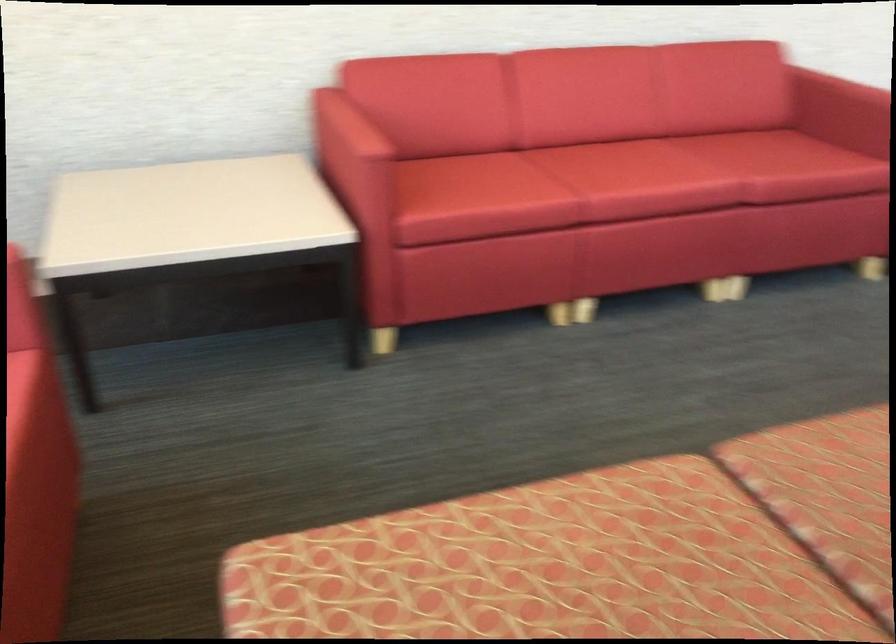
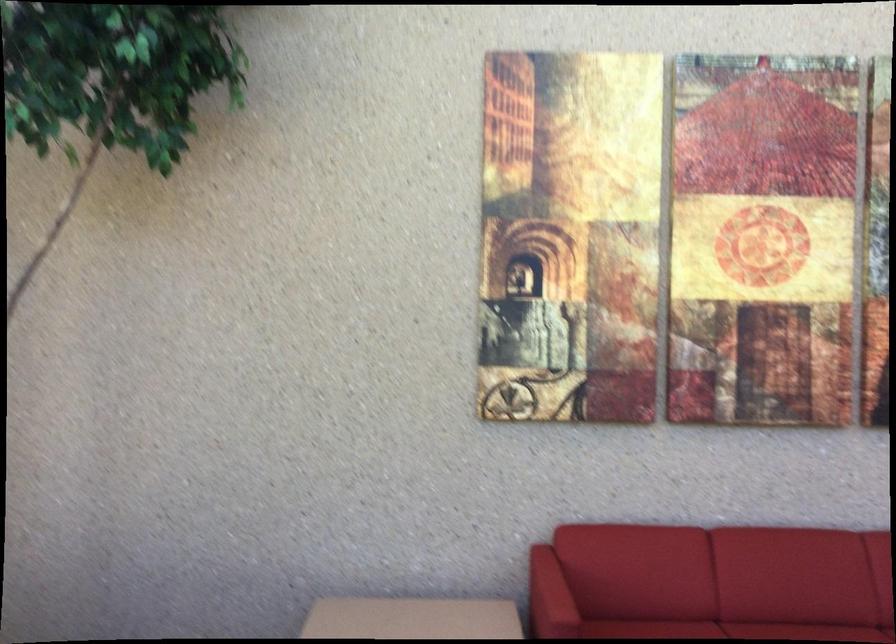
In the second image, find the point that corresponds to (x=530, y=160) in the first image.

(727, 630)